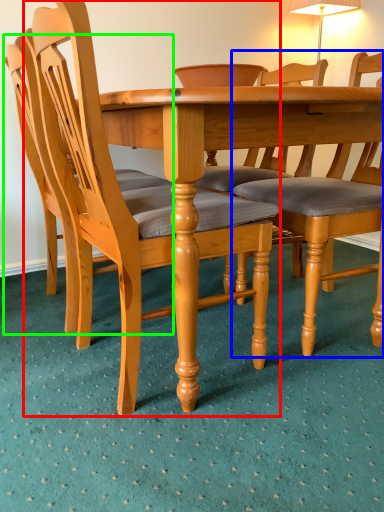
Question: Which object is positioned closest to chair (highlighted by a red box)? Select from chair (highlighted by a blue box) and chair (highlighted by a green box).

Choices:
 (A) chair
 (B) chair

Answer: (B)